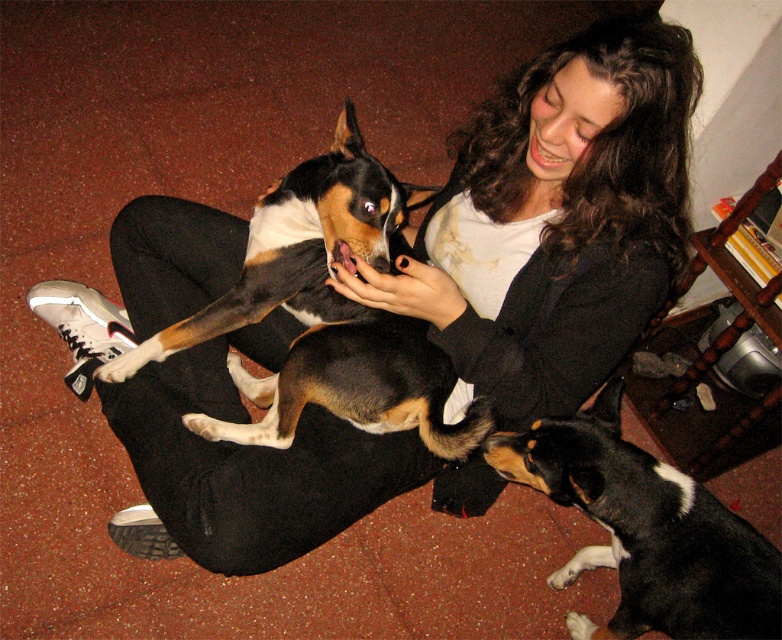
You are a photographer setting up a camera at eye level with the woman. You need to ensure both dogs are fully visible in the frame. Given that the brown and white fur at center is taller than the black and tan fur at center, which dog should you position closer to the camera to avoid blocking the view of the shorter one?

You should position the black and tan fur at center closer to the camera since it is shorter than the brown and white fur at center, allowing both dogs to be fully visible without obstruction.